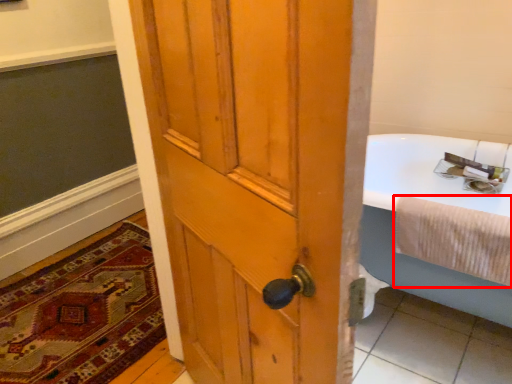
Question: From the image's perspective, what is the correct spatial positioning of bath towel (annotated by the red box) in reference to mat?

Choices:
 (A) above
 (B) below

Answer: (A)